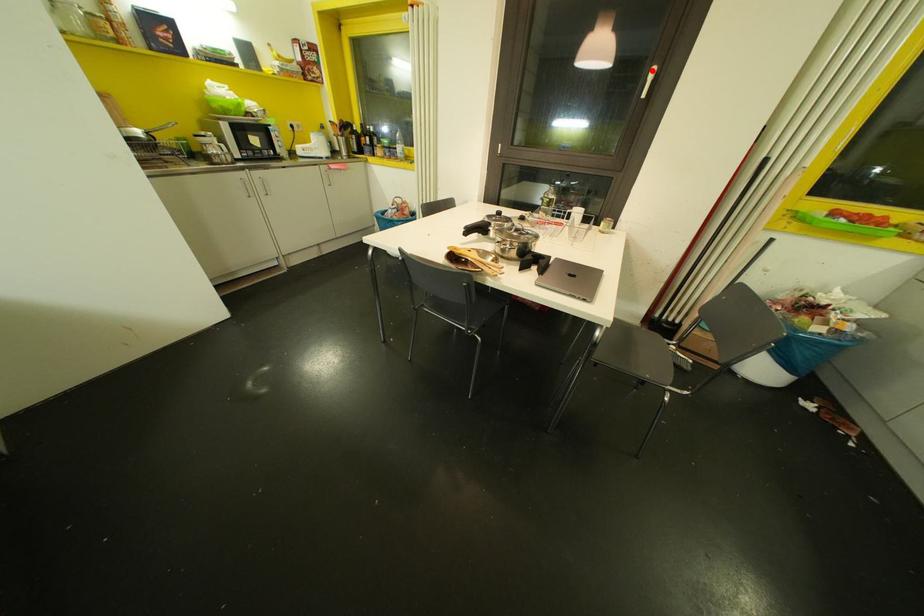
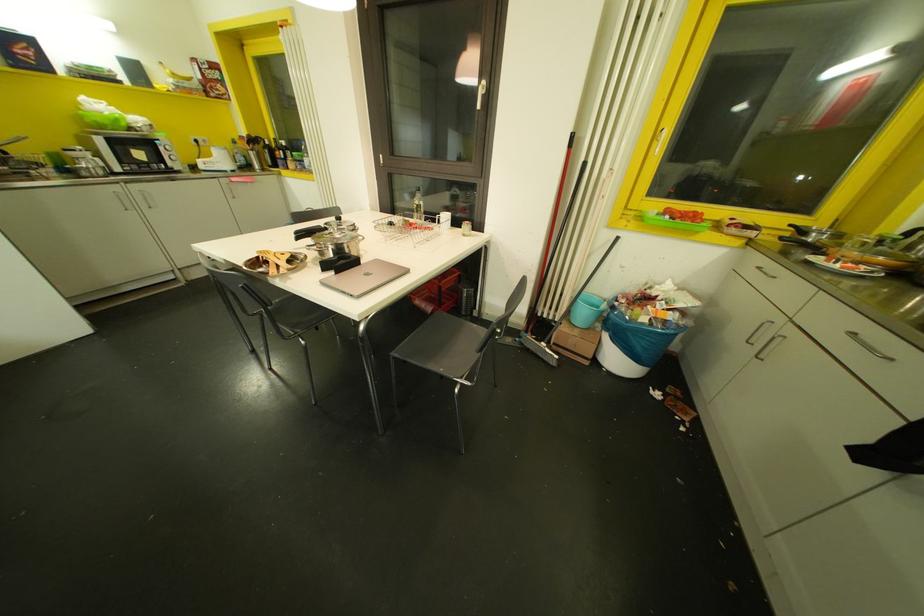
Find the pixel in the second image that matches the highlighted location in the first image.

(481, 81)